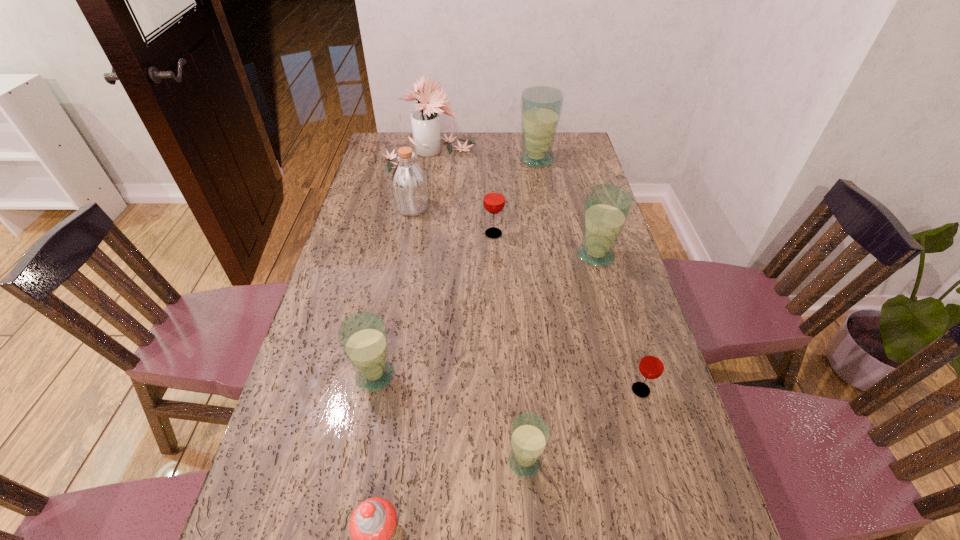
The height and width of the screenshot is (540, 960). Find the location of `vacant space at the right edge`. vacant space at the right edge is located at coordinates (656, 451).

The image size is (960, 540). Find the location of `free location at the far left corner`. free location at the far left corner is located at coordinates (406, 145).

This screenshot has width=960, height=540. In order to click on free area in between the nearest glass and the biggest blue glass in this screenshot , I will do `click(531, 310)`.

Where is `free area in between the second tallest glass and the smaller red glass`? free area in between the second tallest glass and the smaller red glass is located at coordinates (618, 323).

At what (x,y) coordinates should I click in order to perform the action: click on unoccupied area between the right red glass and the second farthest glass. Please return your answer as a coordinate pair (x, y). This screenshot has height=540, width=960. Looking at the image, I should click on 567,312.

This screenshot has height=540, width=960. I want to click on free area in between the tallest glass and the bouquet, so click(x=482, y=157).

Locate an element on the screen. This screenshot has width=960, height=540. object that ranks as the seventh closest to the biggest blue glass is located at coordinates (529, 434).

Identify which object is located as the third nearest to the seventh nearest object. Please provide its 2D coordinates. Your answer should be formatted as a tuple, i.e. [(x, y)], where the tuple contains the x and y coordinates of a point satisfying the conditions above.

[(541, 106)]

Select which glass is the fourth closest to the bigger red glass. Please provide its 2D coordinates. Your answer should be formatted as a tuple, i.e. [(x, y)], where the tuple contains the x and y coordinates of a point satisfying the conditions above.

[(651, 366)]

Point out which glass is positioned as the third nearest to the tallest glass. Please provide its 2D coordinates. Your answer should be formatted as a tuple, i.e. [(x, y)], where the tuple contains the x and y coordinates of a point satisfying the conditions above.

[(651, 366)]